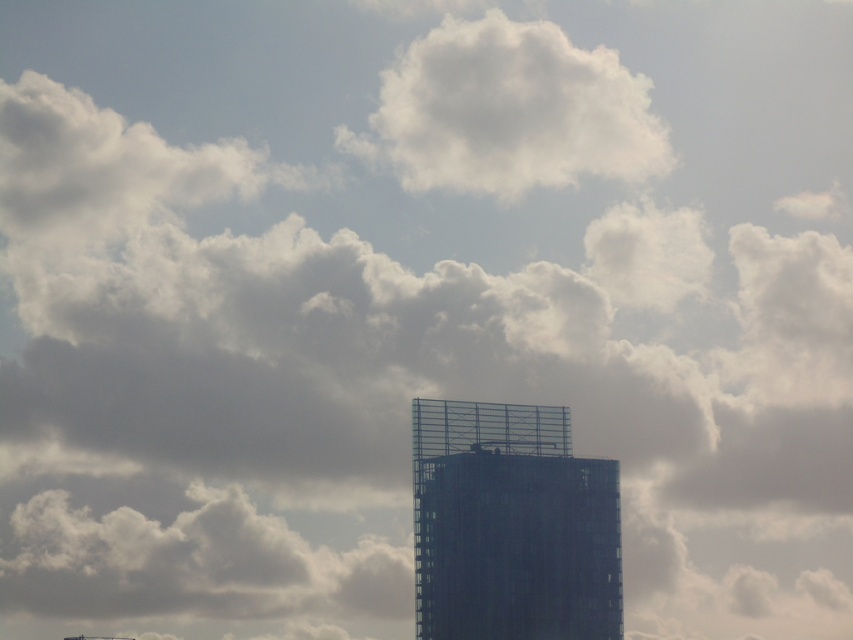
Question: Among these objects, which one is farthest from the camera?

Choices:
 (A) white fluffy cloud at upper center
 (B) transparent glass tower at center

Answer: (A)

Question: Is transparent glass tower at center thinner than white fluffy cloud at upper center?

Choices:
 (A) no
 (B) yes

Answer: (B)

Question: Which of the following is the farthest from the observer?

Choices:
 (A) white fluffy cloud at upper center
 (B) transparent glass tower at center

Answer: (A)

Question: Is transparent glass tower at center closer to the viewer compared to white fluffy cloud at upper center?

Choices:
 (A) yes
 (B) no

Answer: (A)

Question: Does transparent glass tower at center appear under white fluffy cloud at upper center?

Choices:
 (A) yes
 (B) no

Answer: (A)